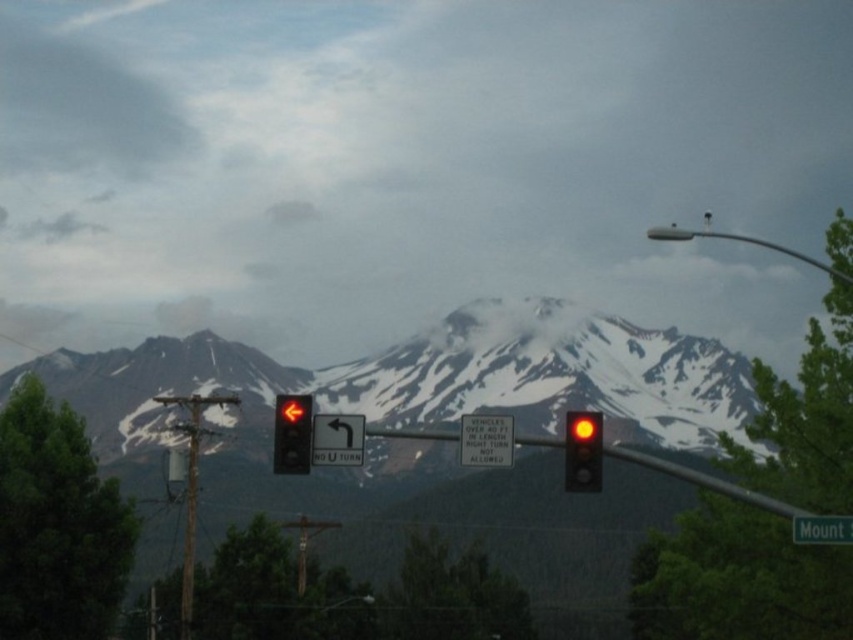
You are standing at the base of the mountain in the image and want to reach the point marked at coordinates point (294, 456). Given that the average walking speed is 3 miles per hour, approximately how many minutes will it take you to walk to that point?

The point marked at coordinates point (294, 456) is 797.14 feet away from the viewer. Converting feet to miles, 797.14 feet is approximately 0.151 miles. At a walking speed of 3 miles per hour, it would take roughly 3 minutes to reach the point.

You are a delivery drone operator planning to fly a drone from the matte glass traffic light at center to a camera located somewhere in the scene. According to the scene description, how far apart are these two objects?

The matte glass traffic light at center and camera are 754.72 feet apart.